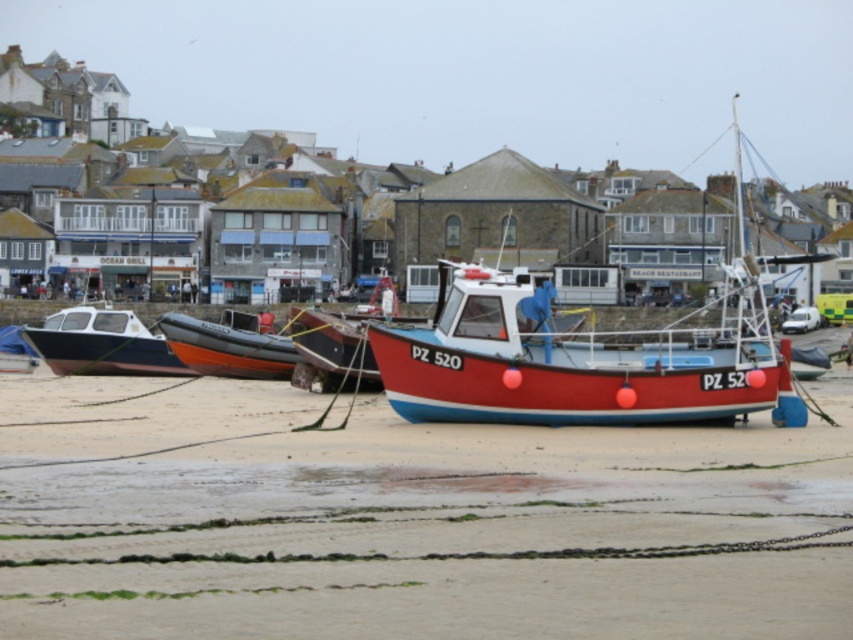
Question: Which of the following is the closest to the observer?

Choices:
 (A) (126, 364)
 (B) (28, 353)
 (C) (515, 612)
 (D) (286, 349)

Answer: (C)

Question: Which object appears closest to the camera in this image?

Choices:
 (A) matte white boat at left
 (B) smooth sand at lower center
 (C) red matte boat at center
 (D) orange rubber dinghy at center

Answer: (B)

Question: Does red matte boat at center come behind matte white boat at left?

Choices:
 (A) no
 (B) yes

Answer: (A)

Question: Observing the image, what is the correct spatial positioning of smooth sand at lower center in reference to red matte boat at center?

Choices:
 (A) left
 (B) right

Answer: (A)

Question: Can you confirm if smooth sand at lower center is positioned below red matte boat at center?

Choices:
 (A) no
 (B) yes

Answer: (B)

Question: Which point is farther to the camera?

Choices:
 (A) (172, 330)
 (B) (335, 481)
 (C) (752, 280)

Answer: (A)